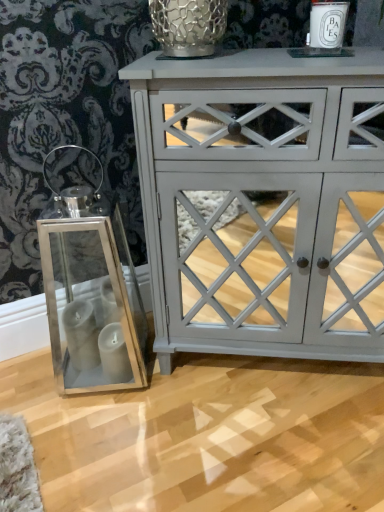
Question: Is white ceramic candle at upper right completely or partially inside metallic mesh glass vase at upper center?

Choices:
 (A) yes
 (B) no

Answer: (B)

Question: Would you consider metallic mesh glass vase at upper center to be distant from white ceramic candle at upper right?

Choices:
 (A) yes
 (B) no

Answer: (B)

Question: Considering the relative sizes of metallic mesh glass vase at upper center and white ceramic candle at upper right in the image provided, is metallic mesh glass vase at upper center bigger than white ceramic candle at upper right?

Choices:
 (A) no
 (B) yes

Answer: (B)

Question: Is metallic mesh glass vase at upper center aimed at white ceramic candle at upper right?

Choices:
 (A) yes
 (B) no

Answer: (B)

Question: From the image's perspective, would you say metallic mesh glass vase at upper center is shown under white ceramic candle at upper right?

Choices:
 (A) no
 (B) yes

Answer: (A)

Question: Is matte gray cabinet at center situated inside white ceramic candle at upper right or outside?

Choices:
 (A) inside
 (B) outside

Answer: (B)

Question: Considering the positions of matte gray cabinet at center and white ceramic candle at upper right in the image, is matte gray cabinet at center bigger or smaller than white ceramic candle at upper right?

Choices:
 (A) big
 (B) small

Answer: (A)

Question: From a real-world perspective, is matte gray cabinet at center positioned above or below white ceramic candle at upper right?

Choices:
 (A) above
 (B) below

Answer: (B)

Question: In terms of height, does matte gray cabinet at center look taller or shorter compared to white ceramic candle at upper right?

Choices:
 (A) short
 (B) tall

Answer: (B)

Question: From the image's perspective, relative to metallic mesh glass vase at upper center, is white ceramic candle at upper right above or below?

Choices:
 (A) below
 (B) above

Answer: (A)

Question: Is white ceramic candle at upper right inside the boundaries of metallic mesh glass vase at upper center, or outside?

Choices:
 (A) outside
 (B) inside

Answer: (A)

Question: Considering the positions of white ceramic candle at upper right and metallic mesh glass vase at upper center in the image, is white ceramic candle at upper right taller or shorter than metallic mesh glass vase at upper center?

Choices:
 (A) tall
 (B) short

Answer: (B)

Question: Is white ceramic candle at upper right to the left or to the right of metallic mesh glass vase at upper center in the image?

Choices:
 (A) left
 (B) right

Answer: (B)

Question: Considering the positions of matte gray cabinet at center and metallic mesh glass vase at upper center in the image, is matte gray cabinet at center bigger or smaller than metallic mesh glass vase at upper center?

Choices:
 (A) small
 (B) big

Answer: (B)

Question: From the image's perspective, is matte gray cabinet at center above or below metallic mesh glass vase at upper center?

Choices:
 (A) above
 (B) below

Answer: (B)